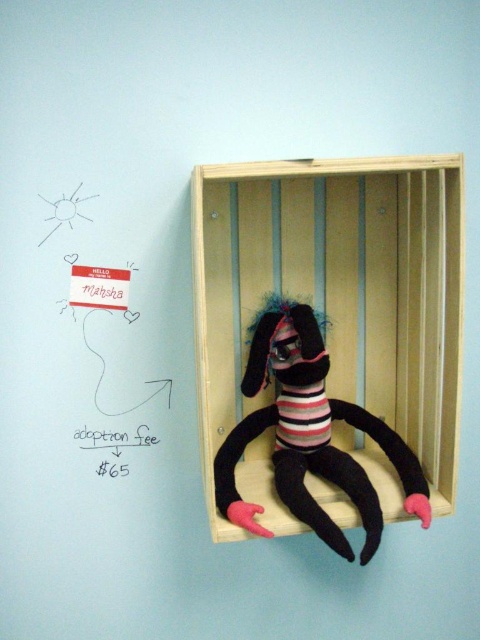
Is wooden crate at center positioned in front of striped fabric plush toy at center?

Yes, wooden crate at center is closer to the viewer.

Can you confirm if wooden crate at center is positioned above striped fabric plush toy at center?

Correct, wooden crate at center is located above striped fabric plush toy at center.

Describe the element at coordinates (337, 292) in the screenshot. I see `wooden crate at center` at that location.

Locate an element on the screen. Image resolution: width=480 pixels, height=640 pixels. wooden crate at center is located at coordinates (337, 292).

Which of these two, striped fabric plush toy at center or black paper adoption fee at center, stands shorter?

Standing shorter between the two is black paper adoption fee at center.

Does striped fabric plush toy at center have a larger size compared to black paper adoption fee at center?

Yes.

Who is more forward, [362,422] or [86,449]?

Point [362,422]

I want to click on striped fabric plush toy at center, so click(x=309, y=435).

Between wooden crate at center and black paper adoption fee at center, which one appears on the right side from the viewer's perspective?

wooden crate at center

Locate an element on the screen. wooden crate at center is located at coordinates (337, 292).

What do you see at coordinates (337, 292) in the screenshot? Image resolution: width=480 pixels, height=640 pixels. I see `wooden crate at center` at bounding box center [337, 292].

Find the location of a particular element. The width and height of the screenshot is (480, 640). wooden crate at center is located at coordinates (337, 292).